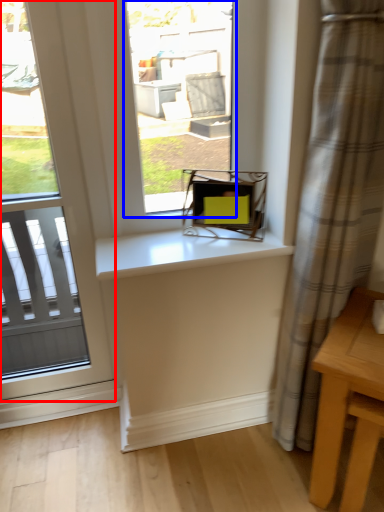
Question: Which point is further to the camera, window (highlighted by a red box) or window (highlighted by a blue box)?

Choices:
 (A) window
 (B) window

Answer: (B)